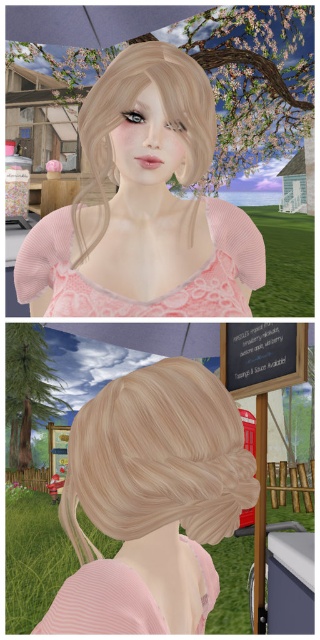
You are a hairstylist observing the two hairstyles in the image. The first is the blonde wood hair bun at upper center and the second is the blonde textured hair at center. You need to place a decorative hairpin between them. What is the minimum length of the hairpin required to fit between them without touching either hairstyle?

The distance between the blonde wood hair bun at upper center and the blonde textured hair at center is 30.13 centimeters. Therefore, the hairpin must be shorter than 30.13 centimeters to fit between them without touching either hairstyle.

Looking at this image, you are looking at the image and notice the matte pink sweater at center and the blondehair at upper center. Based on their positions, which object is located to the right of the other?

The matte pink sweater at center is to the right of the blondehair at upper center.

You are navigating a crowded market and see two points marked in the image. The first point is at coordinates point (60, 259) and the second is at point (73, 520). Which point is located further back in the scene?

Point (60, 259) is behind point (73, 520), so the first point is further back in the scene.